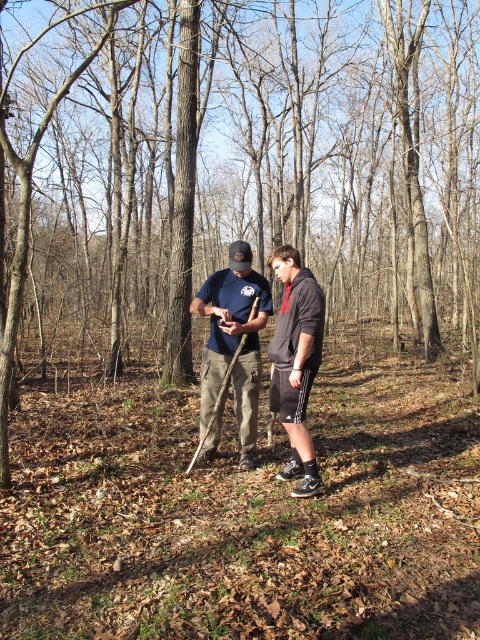
Question: Can you confirm if dark gray hoodie at center is smaller than black matte hoodie at center?

Choices:
 (A) no
 (B) yes

Answer: (A)

Question: Among these points, which one is nearest to the camera?

Choices:
 (A) (289, 323)
 (B) (206, 413)

Answer: (A)

Question: Which object appears farthest from the camera in this image?

Choices:
 (A) dark gray hoodie at center
 (B) black matte hoodie at center

Answer: (A)

Question: Where is dark gray hoodie at center located in relation to black matte hoodie at center in the image?

Choices:
 (A) below
 (B) above

Answer: (B)

Question: Can you confirm if dark gray hoodie at center is positioned to the left of black matte hoodie at center?

Choices:
 (A) no
 (B) yes

Answer: (B)